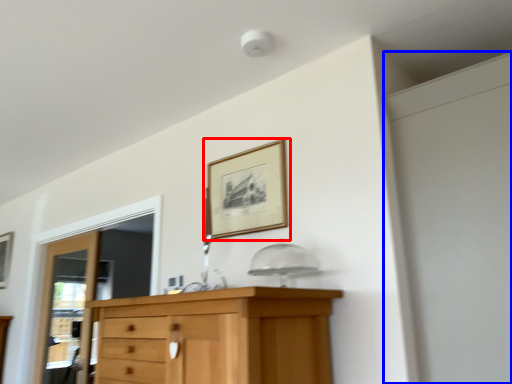
Question: Which point is further to the camera, picture frame (highlighted by a red box) or screen door (highlighted by a blue box)?

Choices:
 (A) picture frame
 (B) screen door

Answer: (A)